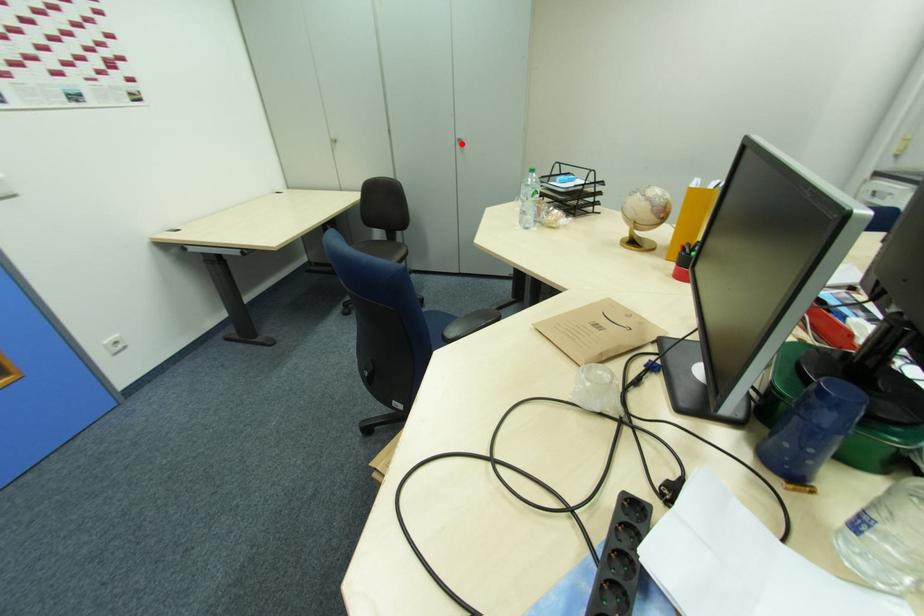
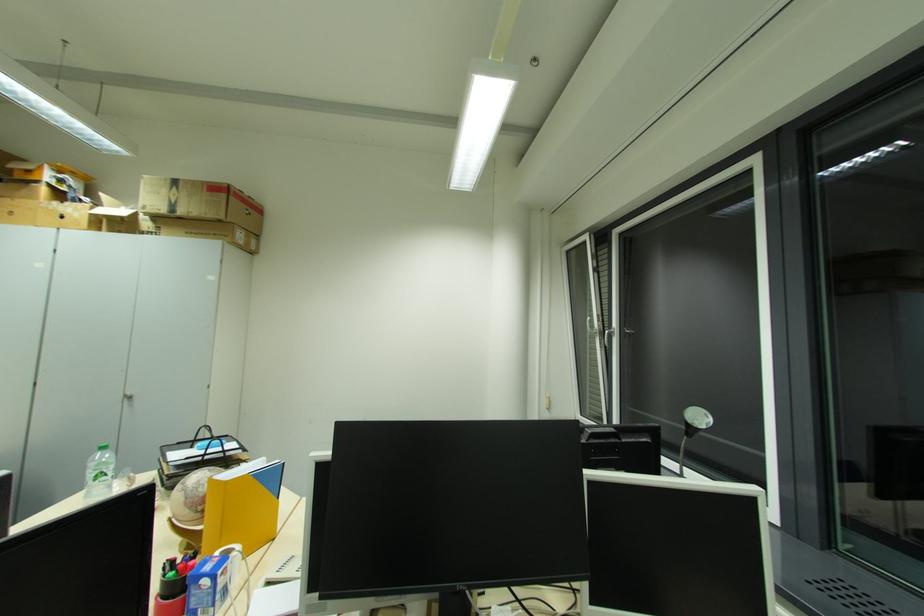
Question: I am providing you with two images of the same scene from different viewpoints. A red point is marked on the first image. At the location where the point appears in image 1, is it still visible in image 2?

Choices:
 (A) Yes
 (B) No

Answer: (A)